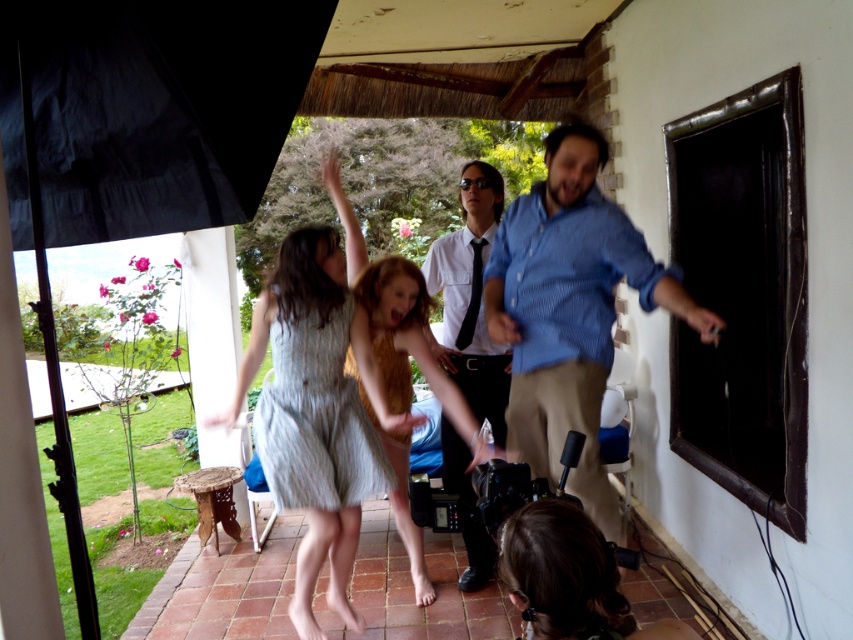
You are a photographer trying to capture the blue striped shirt at center and the white shirt at center in your shot. Which shirt should you focus on first if you want to include both in the frame without moving the camera?

The blue striped shirt at center is above the white shirt at center, so you should focus on the white shirt at center first to ensure both are in the frame without moving the camera.

You are a photographer trying to capture a closeup shot of the striped cotton dress at center and the light brown hair at center. Based on the scene, can you fit both subjects into your camera frame if your camera has a minimum focus distance of 12 inches?

The distance between the striped cotton dress at center and the light brown hair at center is 11.73 inches. Since the minimum focus distance is 12 inches, the camera cannot focus on both subjects simultaneously as the required distance is slightly less than the minimum requirement.

You are a photographer trying to frame a shot that includes both the blue striped shirt at center and the light brown hair at center. Which object should you focus on first to ensure both are in the frame?

You should focus on the light brown hair at center first because it occupies more space than the blue striped shirt at center, ensuring it fits properly before adjusting for the smaller object.